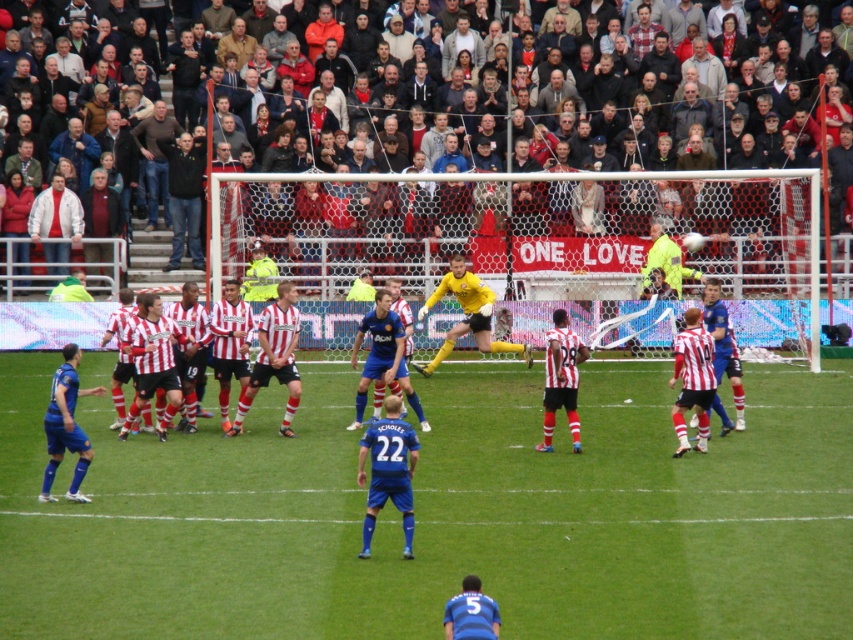
Can you confirm if yellow smooth net at center is thinner than red fabric crowd at upper center?

Indeed, yellow smooth net at center has a lesser width compared to red fabric crowd at upper center.

Based on the photo, is yellow smooth net at center positioned at the back of red fabric crowd at upper center?

No.

Consider the image. Who is more distant from viewer, (770, 256) or (758, 195)?

The point (770, 256) is more distant.

Where is `yellow smooth net at center`? The height and width of the screenshot is (640, 853). yellow smooth net at center is located at coordinates (416, 228).

Can you confirm if dark green jacket at upper left is positioned to the left of matte red and white jersey at center?

Correct, you'll find dark green jacket at upper left to the left of matte red and white jersey at center.

Does dark green jacket at upper left have a larger size compared to matte red and white jersey at center?

Indeed, dark green jacket at upper left has a larger size compared to matte red and white jersey at center.

Which is in front, point (194, 256) or point (561, 352)?

Point (561, 352) is in front.

Identify the location of dark green jacket at upper left. This screenshot has width=853, height=640. (184, 196).

Which is in front, point (410, 576) or point (653, 410)?

Point (410, 576)

Which is more to the right, green grass football field at center or striped jersey players at center?

Positioned to the right is striped jersey players at center.

What do you see at coordinates (440, 515) in the screenshot? I see `green grass football field at center` at bounding box center [440, 515].

In order to click on green grass football field at center in this screenshot , I will do `click(440, 515)`.